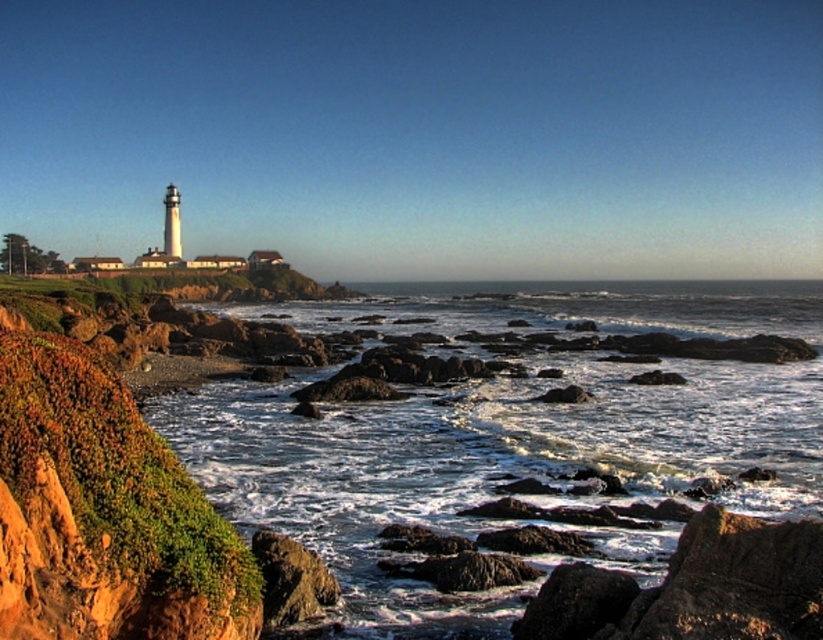
You are a hiker standing at the base of the lighthouse on the grassy hill. You spot a rustic rock cliff at left located at point (103, 509). If you walk straight ahead from your current position, will you reach the rustic rock cliff at left before the ocean?

The rustic rock cliff at left is located at point (103, 509), which is to the left side of the scene. Since the ocean is at the far end of the scene beyond the lighthouse and the buildings, walking straight ahead from the lighthouse would lead towards the ocean first before reaching the rustic rock cliff at left. Therefore, you would reach the ocean before the rustic rock cliff at left.

You are a photographer planning to capture the rugged coastal landscape. You notice the white frothy water at lower center and the rusty rock at lower left. Which of these two features is wider when viewed from your current position?

The white frothy water at lower center is wider than the rusty rock at lower left.